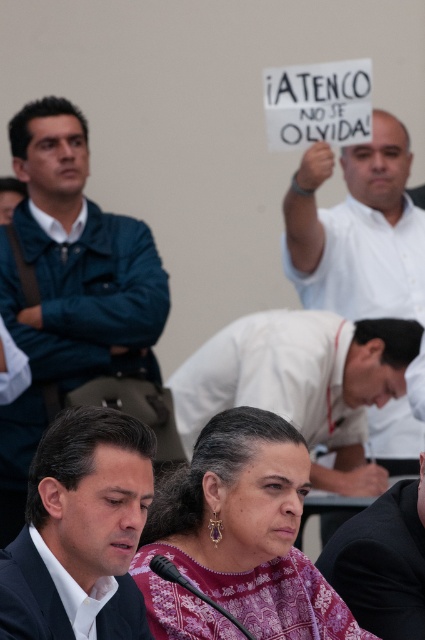
Question: Which object is the farthest from the white matte shirt at upper right?

Choices:
 (A) black fabric shirt at lower center
 (B) purple printed blouse at center
 (C) matte black man at lower left

Answer: (C)

Question: Where is purple printed blouse at center located in relation to matte black man at lower left in the image?

Choices:
 (A) above
 (B) below

Answer: (B)

Question: Which object appears closest to the camera in this image?

Choices:
 (A) dark blue jacket at left
 (B) purple printed blouse at center
 (C) white matte shirt at upper right

Answer: (B)

Question: Can you confirm if white matte shirt at upper right is thinner than black fabric shirt at lower center?

Choices:
 (A) yes
 (B) no

Answer: (B)

Question: Can you confirm if matte black man at lower left is wider than white matte shirt at upper right?

Choices:
 (A) no
 (B) yes

Answer: (A)

Question: Considering the real-world distances, which object is farthest from the white matte shirt at upper right?

Choices:
 (A) black fabric shirt at lower center
 (B) purple printed blouse at center
 (C) matte black man at lower left

Answer: (C)